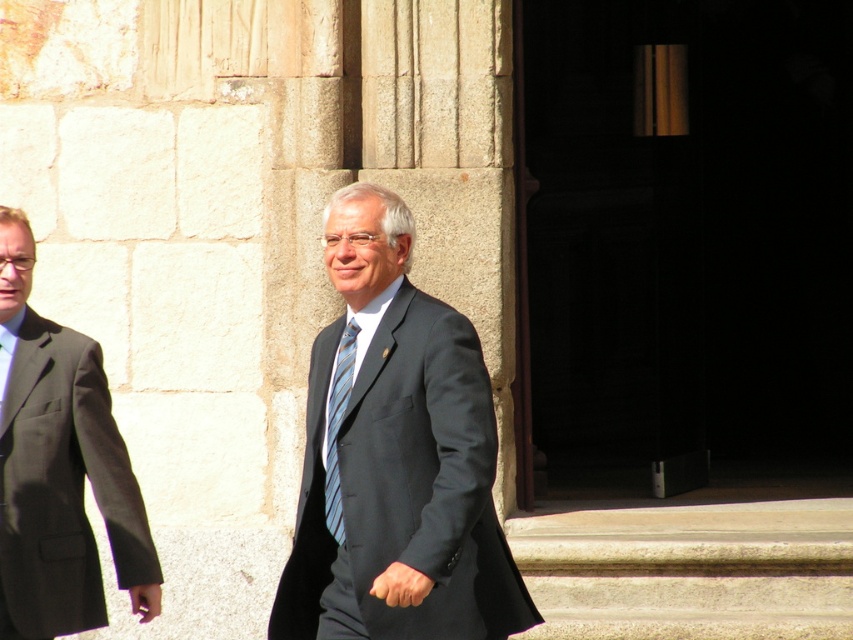
From the picture: You are standing at the point marked by point (395, 456) and need to walk to the nearest exit. The nearest exit is located at the edge of the stone wall. In which direction should you walk to reach the exit?

The nearest exit is located at the edge of the stone wall. Since the person represented by point (395, 456) is in the center, moving towards the edge of the stone wall would be the correct direction. However, without specific spatial coordinates for the exit, it is challenging to determine the exact direction. The answer should be based on the given information that the exit is at the edge of the stone wall, so the direction would be towards the wall.

You are a photographer trying to capture the matte black suit at left and the striped fabric tie at center in a single frame. Based on their positions, can you determine which object is closer to the camera?

The matte black suit at left is located above the striped fabric tie at center, which means it is closer to the camera since objects higher in the frame are typically nearer in such compositions.